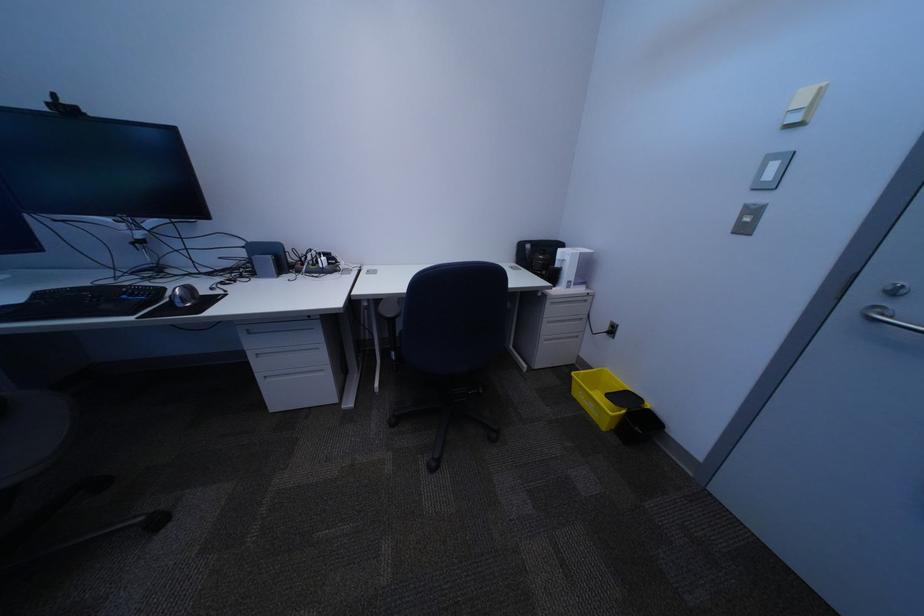
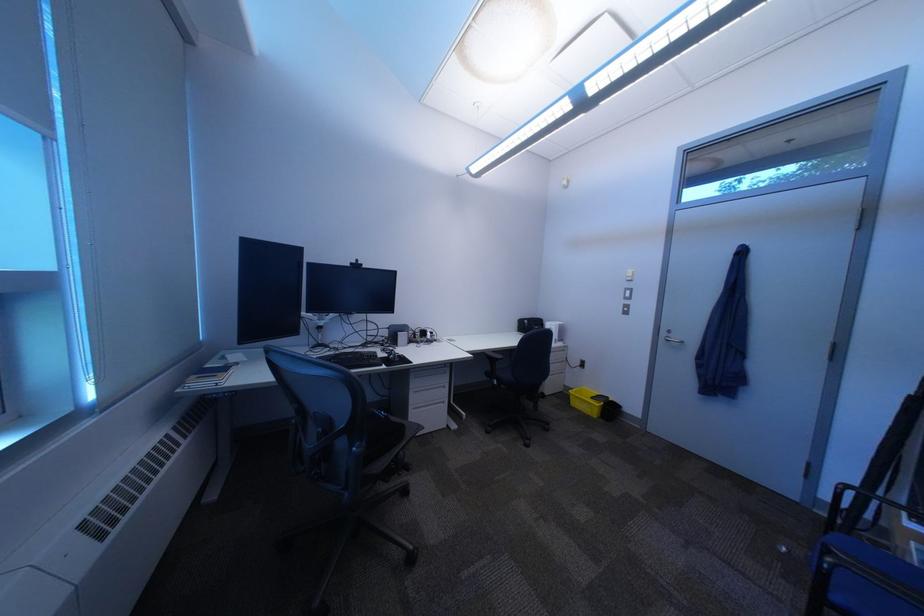
Which direction would the cameraman need to move to produce the second image?

The cameraman moved toward left, backward.